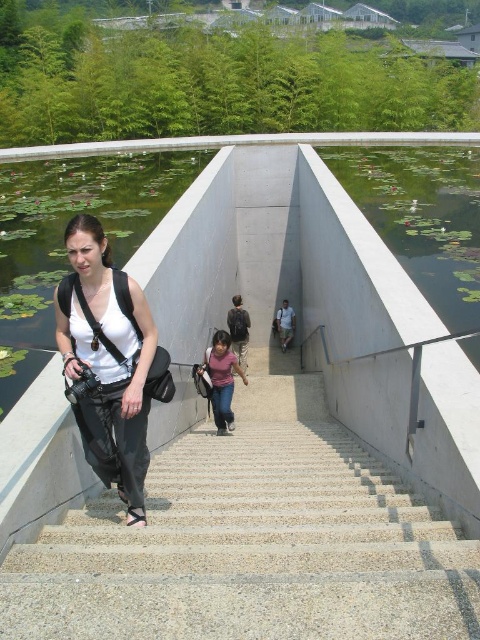
You are standing at the bottom of the concrete stairs at center and want to take a photo of the green lily pads at left. Which direction should you move to get a better view of the lily pads without blocking them with the stairs?

Since the concrete stairs at center are closer to the viewer than the green lily pads at left, you should move to the right side of the stairs to avoid blocking the view of the lily pads.

You are standing at the bottom of the concrete stairs at center and want to take a photo of the white matte tank top at center. Which direction should you turn to frame the subject properly?

The concrete stairs at center are to the right of the white matte tank top at center, so you should turn to your left to frame the subject properly.